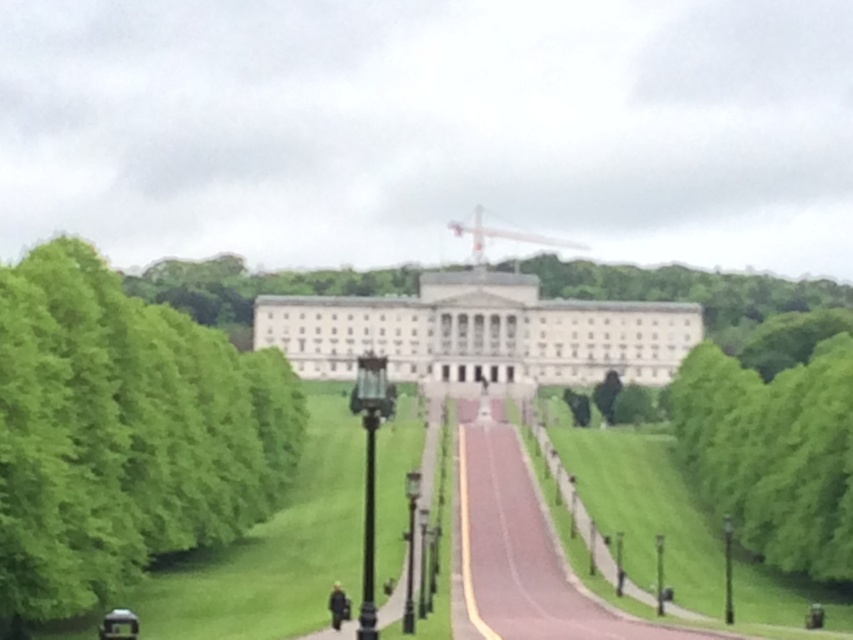
You are standing at the entrance of the building and want to walk straight towards the black polished metal lamp post at center. Which direction should you walk?

You should walk straight towards the black polished metal lamp post at center as it is located along the central pathway leading away from the building.

You are standing at the entrance of the building and want to take a photo of the black polished metal lamp post at center. The camera you are using has a maximum focus range of 30 meters. Can the camera capture the lamp post clearly?

The black polished metal lamp post at center and camera are 33.60 meters apart. Since the camera can only focus up to 30 meters, it cannot capture the lamp post clearly at this distance.